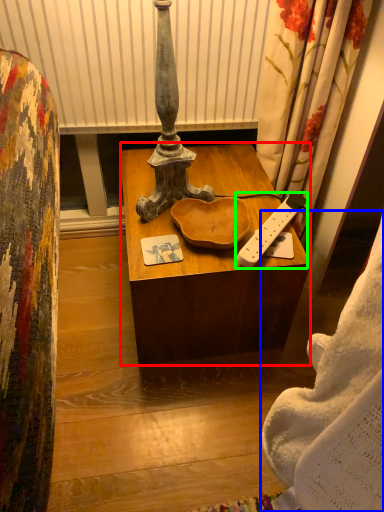
Question: Which object is the closest to the desk (highlighted by a red box)? Choose among these: blanket (highlighted by a blue box) or remote control (highlighted by a green box).

Choices:
 (A) blanket
 (B) remote control

Answer: (B)